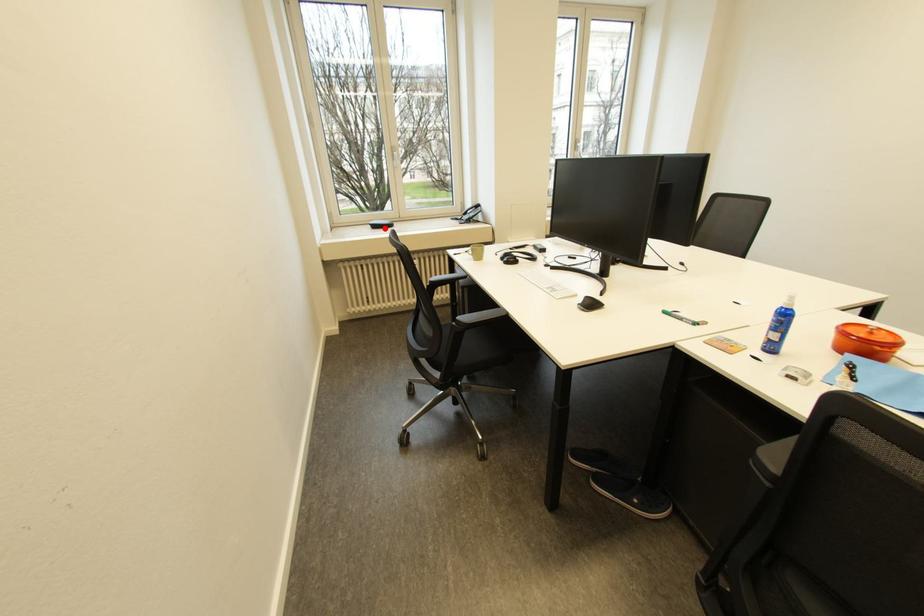
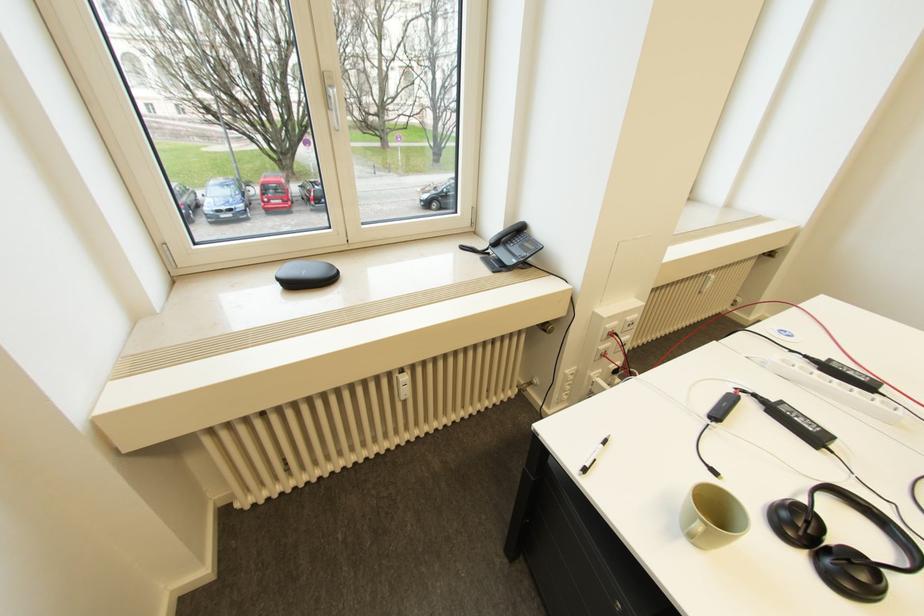
Question: I am providing you with two images of the same scene from different viewpoints. Image1 has a red point marked. In image2, the corresponding 3D location appears at what relative position? Reply with the corresponding letter.

Choices:
 (A) Closer
 (B) Farther

Answer: (A)